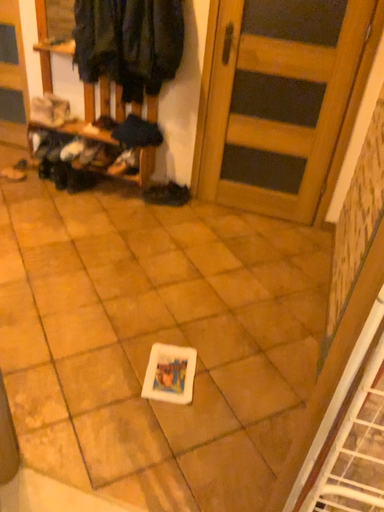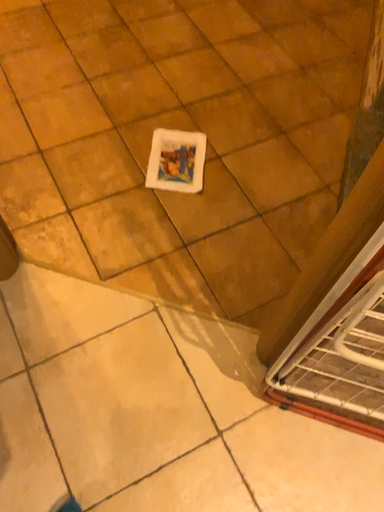
Question: Which way did the camera rotate in the video?

Choices:
 (A) rotated downward
 (B) rotated upward

Answer: (A)